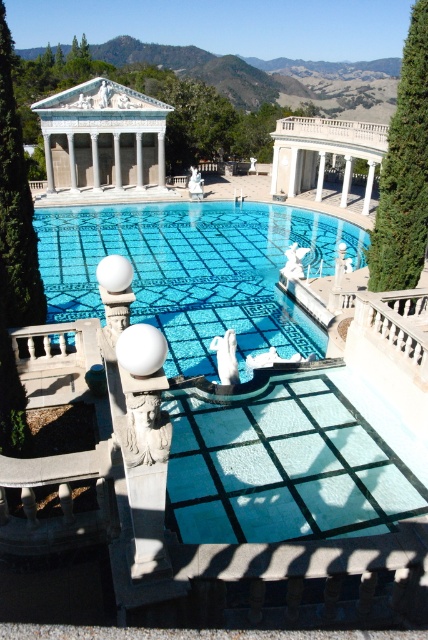
Can you confirm if white marble gazebo at upper center is positioned to the right of green leafy cypress tree at upper right?

No, white marble gazebo at upper center is not to the right of green leafy cypress tree at upper right.

Is point (113, 104) in front of point (409, 150)?

That is False.

Locate an element on the screen. The image size is (428, 640). white marble gazebo at upper center is located at coordinates (103, 136).

Between white marble gazebo at upper center and white marble balustrade at upper right, which one appears on the right side from the viewer's perspective?

white marble balustrade at upper right

Does white marble gazebo at upper center lie in front of white marble balustrade at upper right?

No, it is behind white marble balustrade at upper right.

Is point (139, 134) positioned before point (374, 294)?

No, it is behind (374, 294).

The image size is (428, 640). What are the coordinates of `white marble gazebo at upper center` in the screenshot? It's located at (103, 136).

Between blue glass mosaic at center and green leafy cypress tree at left, which one has less height?

green leafy cypress tree at left

What do you see at coordinates (193, 272) in the screenshot? I see `blue glass mosaic at center` at bounding box center [193, 272].

This screenshot has width=428, height=640. Identify the location of blue glass mosaic at center. (193, 272).